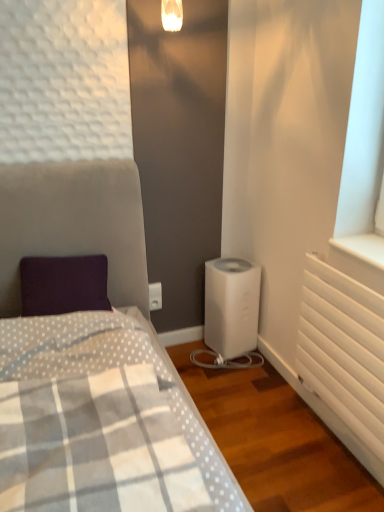
Locate an element on the screen. free space above white matte radiator at right (from a real-world perspective) is located at coordinates (353, 270).